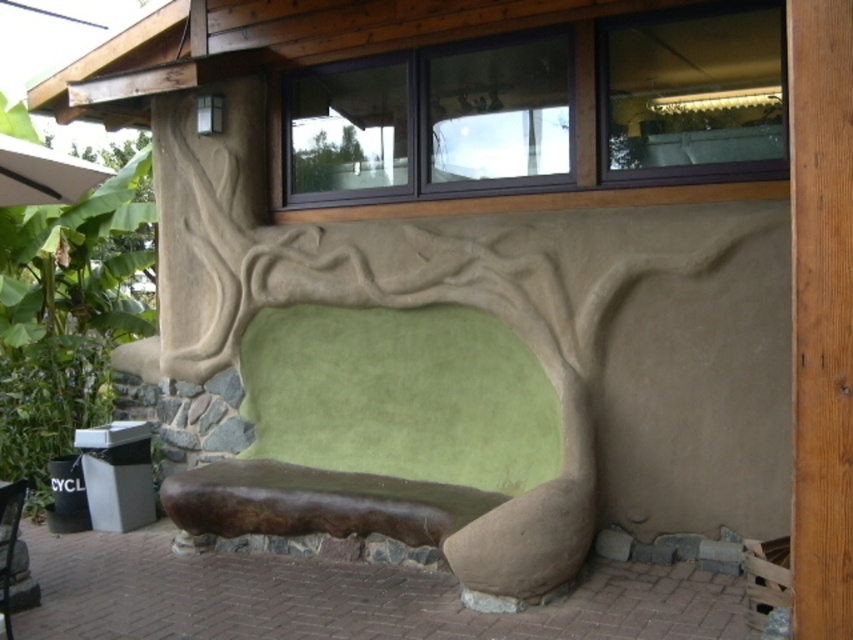
Which is more to the right, brown wood at center or green leafy tree at lower left?

From the viewer's perspective, brown wood at center appears more on the right side.

Does point (849, 346) lie in front of point (4, 99)?

Yes, point (849, 346) is closer to viewer.

Who is more distant from viewer, (840,128) or (94,413)?

Point (94,413)

This screenshot has height=640, width=853. I want to click on brown wood at center, so click(821, 314).